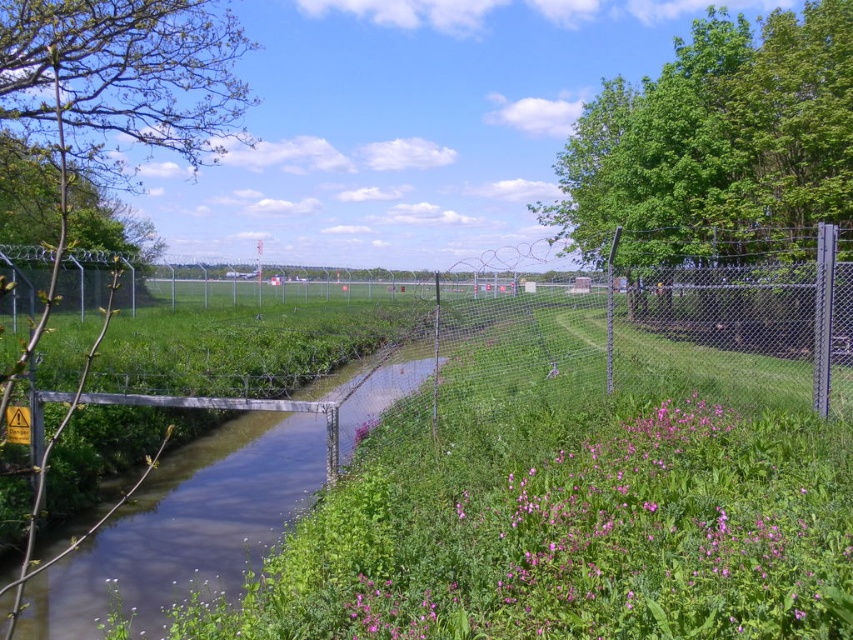
Question: Can you confirm if green leafy tree at upper right is thinner than green leafy tree at left?

Choices:
 (A) yes
 (B) no

Answer: (A)

Question: Which of the following is the closest to the observer?

Choices:
 (A) green leafy tree at left
 (B) green leafy tree at upper right

Answer: (A)

Question: Is green leafy tree at upper right to the left of green leafy tree at left from the viewer's perspective?

Choices:
 (A) yes
 (B) no

Answer: (B)

Question: Does green leafy tree at upper right appear on the right side of green leafy tree at left?

Choices:
 (A) no
 (B) yes

Answer: (B)